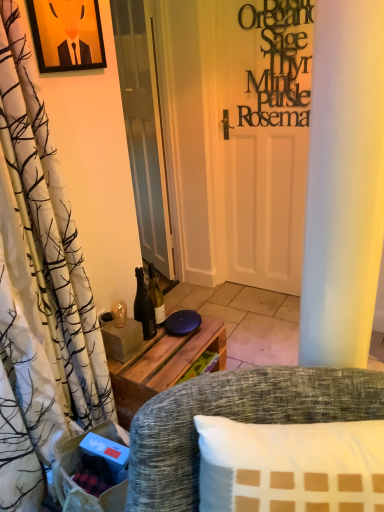
Question: Would you say matte black picture frame at upper left is outside white glossy door at center?

Choices:
 (A) yes
 (B) no

Answer: (A)

Question: Does matte black picture frame at upper left come behind white glossy door at center?

Choices:
 (A) no
 (B) yes

Answer: (A)

Question: Is white glossy door at center at the back of matte black picture frame at upper left?

Choices:
 (A) no
 (B) yes

Answer: (A)

Question: Considering the relative sizes of matte black picture frame at upper left and white glossy door at center in the image provided, is matte black picture frame at upper left wider than white glossy door at center?

Choices:
 (A) yes
 (B) no

Answer: (B)

Question: Does matte black picture frame at upper left have a greater height compared to white glossy door at center?

Choices:
 (A) yes
 (B) no

Answer: (B)

Question: Looking at the image, does textured gray fabric chair at lower center seem bigger or smaller compared to shiny glass bottle at center?

Choices:
 (A) small
 (B) big

Answer: (B)

Question: Considering the positions of textured gray fabric chair at lower center and shiny glass bottle at center in the image, is textured gray fabric chair at lower center wider or thinner than shiny glass bottle at center?

Choices:
 (A) wide
 (B) thin

Answer: (A)

Question: From the image's perspective, relative to shiny glass bottle at center, is textured gray fabric chair at lower center above or below?

Choices:
 (A) above
 (B) below

Answer: (B)

Question: In the image, is textured gray fabric chair at lower center positioned in front of or behind shiny glass bottle at center?

Choices:
 (A) behind
 (B) front

Answer: (B)

Question: Is black matte sign at upper right to the left or to the right of matte black picture frame at upper left in the image?

Choices:
 (A) left
 (B) right

Answer: (B)

Question: Is black matte sign at upper right situated inside matte black picture frame at upper left or outside?

Choices:
 (A) inside
 (B) outside

Answer: (B)

Question: From their relative heights in the image, would you say black matte sign at upper right is taller or shorter than matte black picture frame at upper left?

Choices:
 (A) tall
 (B) short

Answer: (A)

Question: Looking at their shapes, would you say black matte sign at upper right is wider or thinner than matte black picture frame at upper left?

Choices:
 (A) wide
 (B) thin

Answer: (A)

Question: From the image's perspective, is white glossy door at center located above or below shiny glass bottle at center?

Choices:
 (A) below
 (B) above

Answer: (B)

Question: Considering the positions of white glossy door at center and shiny glass bottle at center in the image, is white glossy door at center taller or shorter than shiny glass bottle at center?

Choices:
 (A) short
 (B) tall

Answer: (B)